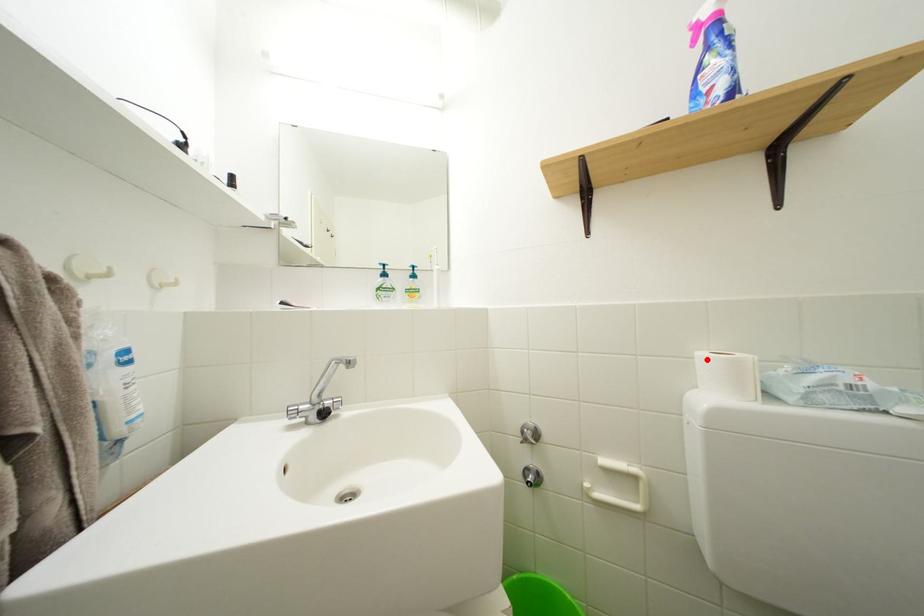
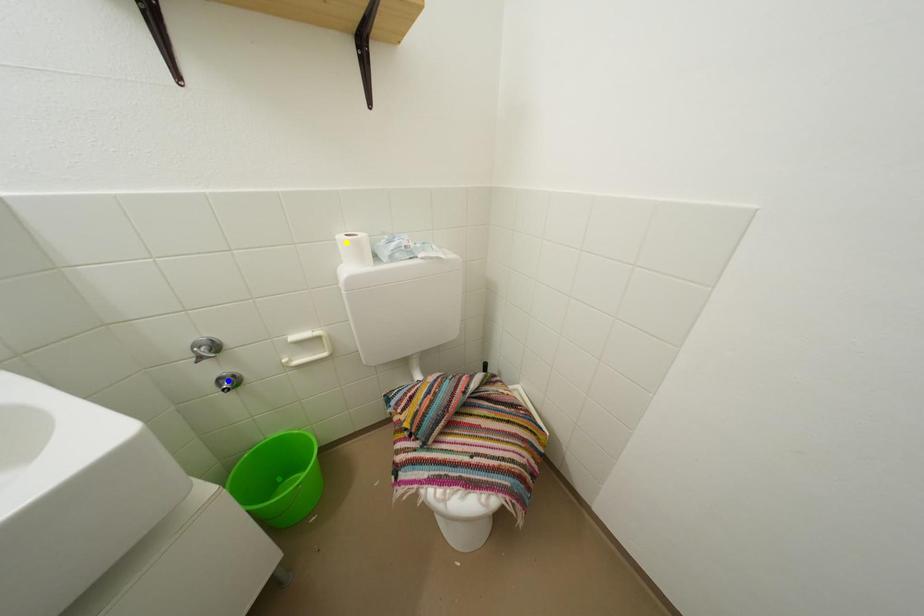
Question: I am providing you with two images of the same scene from different viewpoints. A red point is marked on the first image. You are given multiple points on the second image. Can you choose the point in image 2 that corresponds to the point in image 1?

Choices:
 (A) green point
 (B) yellow point
 (C) blue point

Answer: (B)